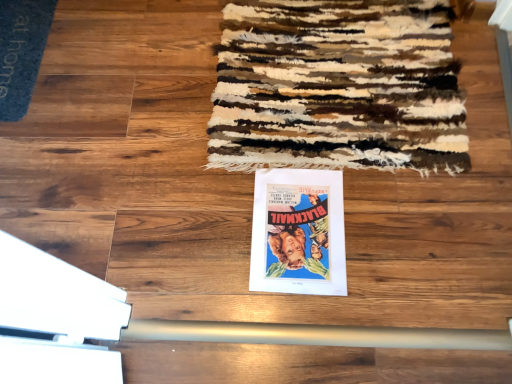
What are the coordinates of `vacant space positioned to the left of textured woolen mat at upper center` in the screenshot? It's located at (130, 116).